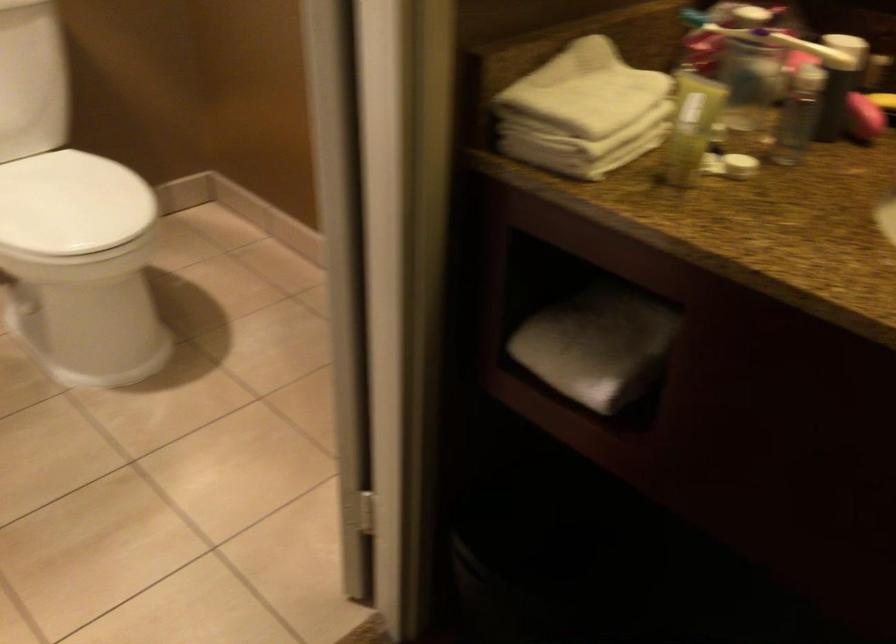
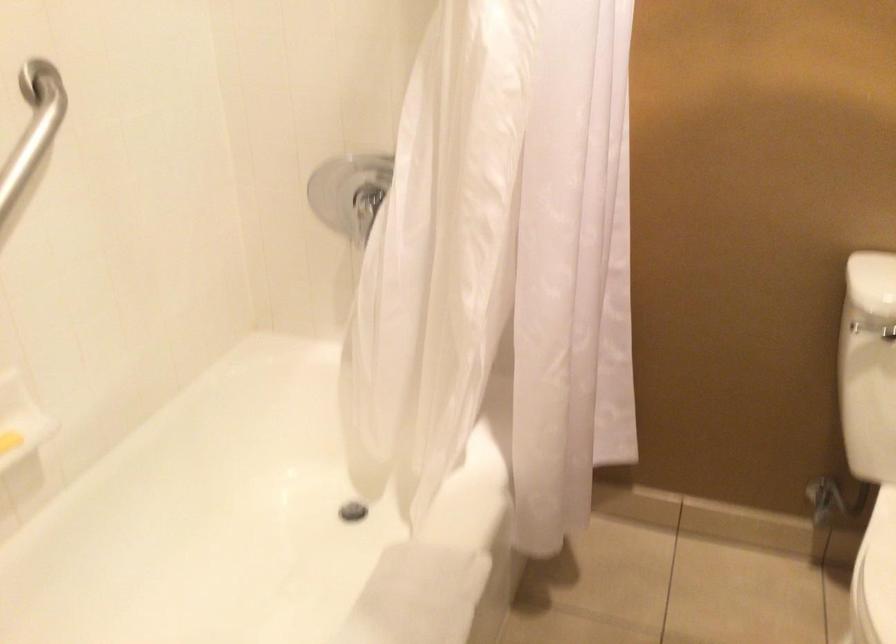
Question: The images are taken continuously from a first-person perspective. In which direction is your viewpoint rotating?

Choices:
 (A) Left
 (B) Right
 (C) Up
 (D) Down

Answer: (A)